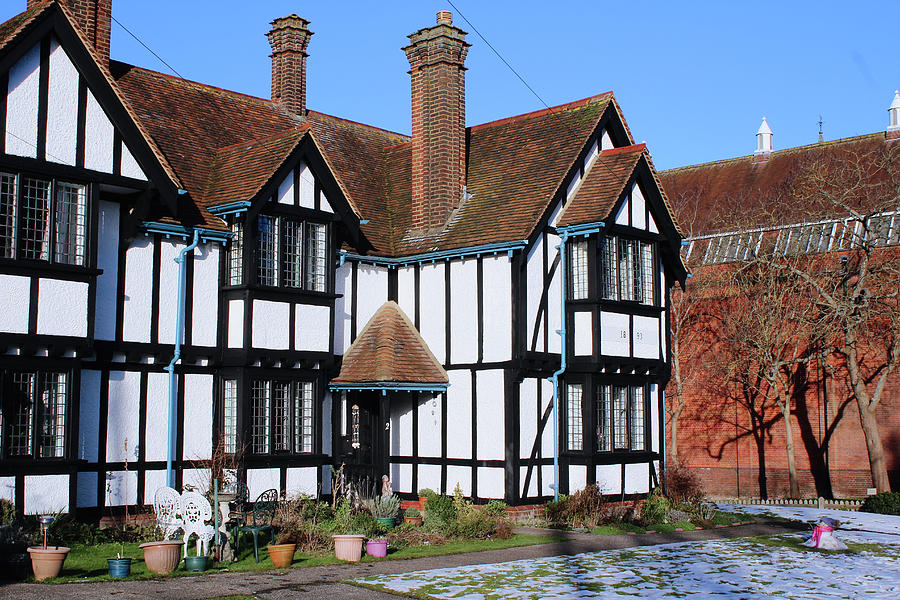
Find the location of a particular element. Image resolution: width=900 pixels, height=600 pixels. white chairs is located at coordinates (195, 517), (164, 499).